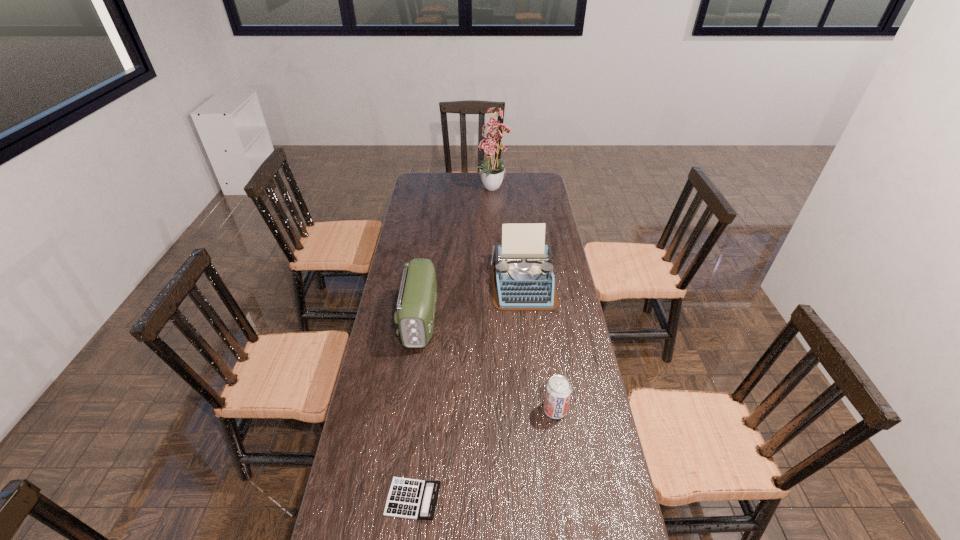
At what (x,y) coordinates should I click in order to perform the action: click on free location that satisfies the following two spatial constraints: 1. on the typing side of the typewriter; 2. on the right side of the soda can. Please return your answer as a coordinate pair (x, y). The width and height of the screenshot is (960, 540). Looking at the image, I should click on (537, 409).

This screenshot has height=540, width=960. I want to click on vacant space that satisfies the following two spatial constraints: 1. on the front-facing side of the radio_receiver; 2. on the right side of the calculator, so tap(395, 499).